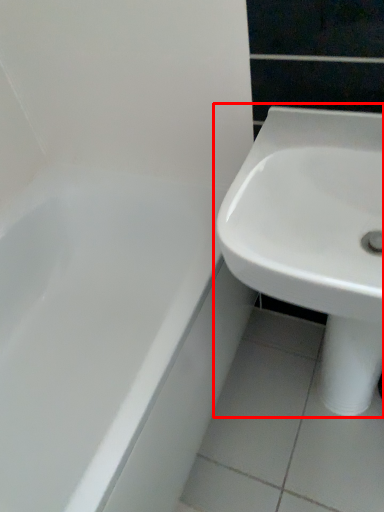
Question: Considering the relative positions of sink (annotated by the red box) and bathtub in the image provided, where is sink (annotated by the red box) located with respect to the staircase?

Choices:
 (A) right
 (B) left

Answer: (A)